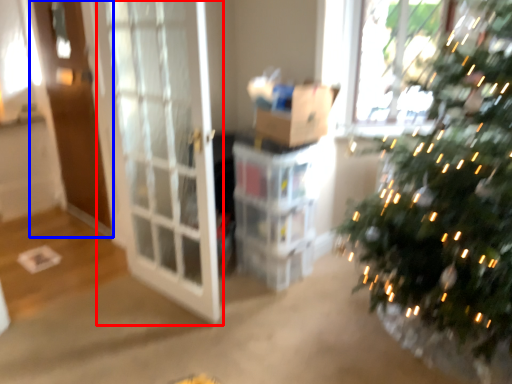
Question: Which object is further to the camera taking this photo, screen door (highlighted by a red box) or screen door (highlighted by a blue box)?

Choices:
 (A) screen door
 (B) screen door

Answer: (B)